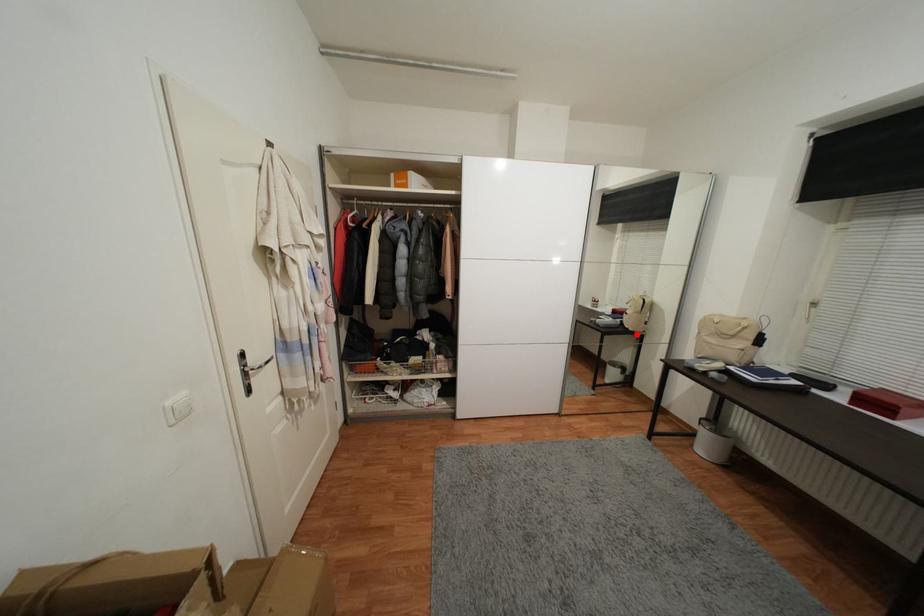
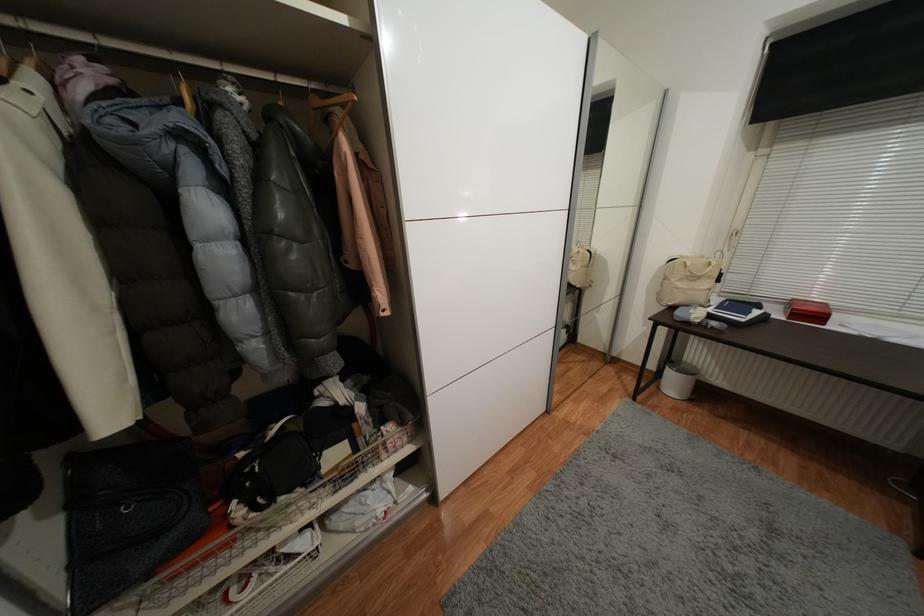
Question: I am providing you with two images of the same scene from different viewpoints. Given a red point in image1, look at the same physical point in image2. Is it:

Choices:
 (A) Closer to the viewpoint
 (B) Farther from the viewpoint

Answer: (B)